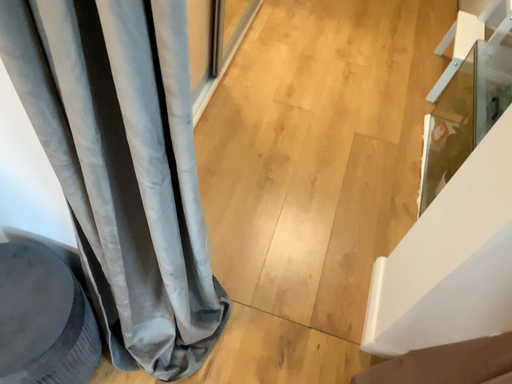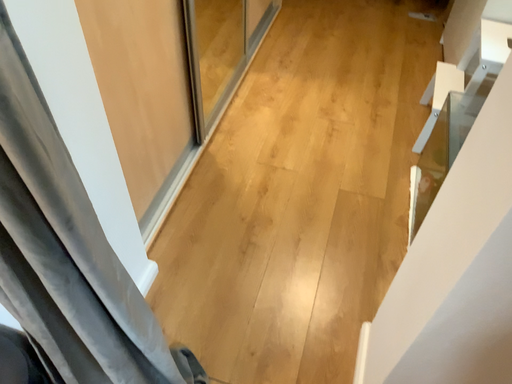
Question: Which way did the camera rotate in the video?

Choices:
 (A) rotated upward
 (B) rotated downward

Answer: (A)